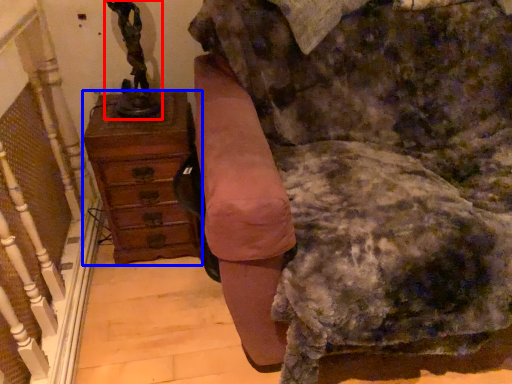
Question: Among these objects, which one is farthest to the camera, sculpture (highlighted by a red box) or chest of drawers (highlighted by a blue box)?

Choices:
 (A) sculpture
 (B) chest of drawers

Answer: (B)